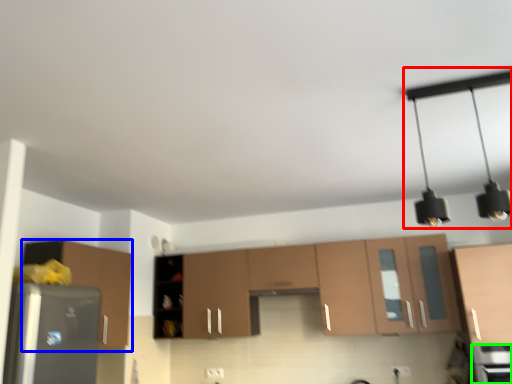
Question: Estimate the real-world distances between objects in this image. Which object is farther from light fixture (highlighted by a red box), cabinetry (highlighted by a blue box) or appliance (highlighted by a green box)?

Choices:
 (A) cabinetry
 (B) appliance

Answer: (A)